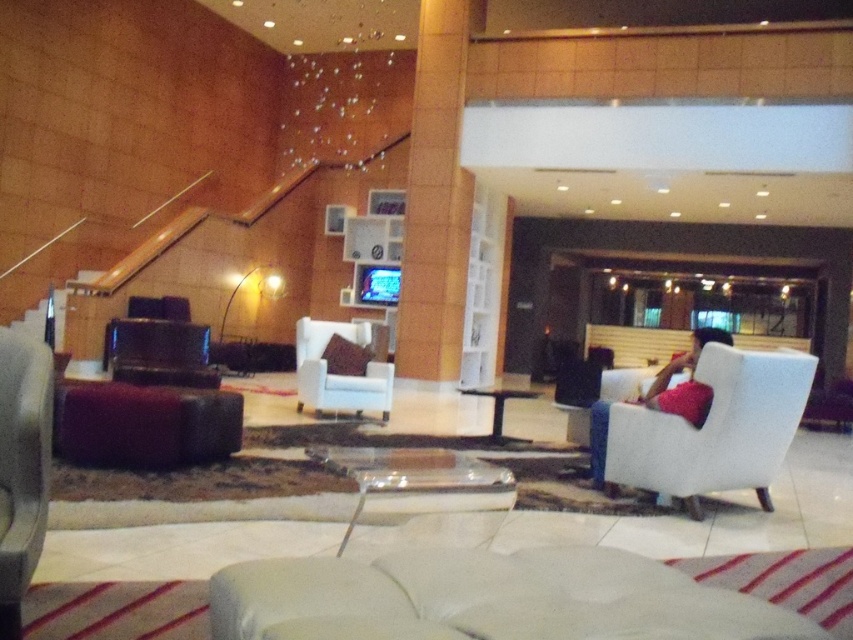
You are standing in the lobby and want to move from the entrance to the glass coffee table. There are two points marked on the floor, point 1 at coordinates point (x=448, y=113) and point 2 at point (x=128, y=406). Which point should you avoid stepping on if you want to stay on the path towards the coffee table?

You should avoid stepping on point (x=448, y=113) because it is behind the coffee table relative to your starting position at the entrance, so the correct path towards the coffee table would pass near point (x=128, y=406) instead.